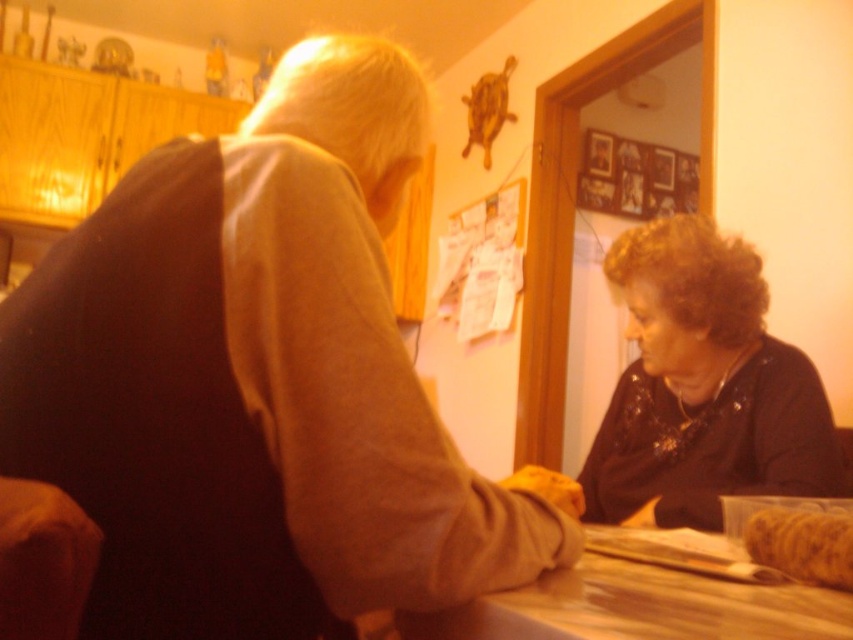
Question: Can you confirm if dark brown sweater at lower right is positioned to the left of wooden at center?

Choices:
 (A) no
 (B) yes

Answer: (A)

Question: Does brown matte sweater at upper left appear on the left side of yellow fluffy bread at lower right?

Choices:
 (A) yes
 (B) no

Answer: (A)

Question: Among these points, which one is farthest from the camera?

Choices:
 (A) (751, 634)
 (B) (171, 380)

Answer: (B)

Question: Estimate the real-world distances between objects in this image. Which object is closer to the yellow fluffy bread at lower right?

Choices:
 (A) dark brown sweater at lower right
 (B) wooden at center

Answer: (B)

Question: Considering the real-world distances, which object is closest to the brown matte sweater at upper left?

Choices:
 (A) dark brown sweater at lower right
 (B) yellow fluffy bread at lower right

Answer: (B)

Question: Can you confirm if brown matte sweater at upper left is thinner than wooden at center?

Choices:
 (A) no
 (B) yes

Answer: (A)